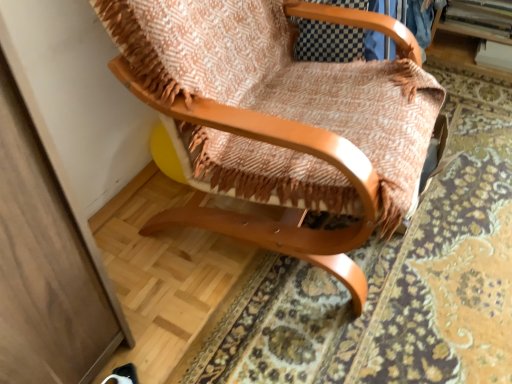
At what (x,y) coordinates should I click in order to perform the action: click on vacant space to the right of wooden chair at center. Please return your answer as a coordinate pair (x, y). Looking at the image, I should click on (472, 200).